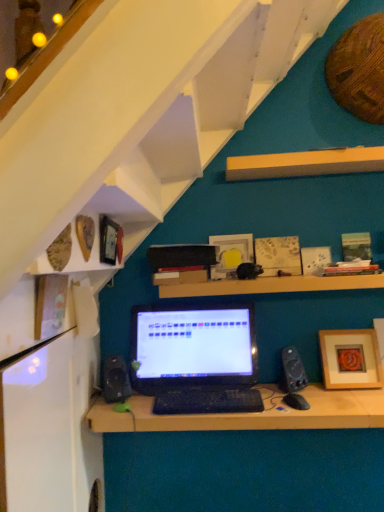
Question: From the image's perspective, would you say yellow wood shelf at upper center, positioned as the 3th shelf in bottom-to-top order, is shown under wooden picture frame at lower right, the third picture frame positioned from the front?

Choices:
 (A) no
 (B) yes

Answer: (A)

Question: Is wooden picture frame at lower right, positioned as the fifth picture frame in left-to-right order, surrounded by yellow wood shelf at upper center, arranged as the 1th shelf when viewed from the top?

Choices:
 (A) no
 (B) yes

Answer: (A)

Question: Can you confirm if yellow wood shelf at upper center, positioned as the 3th shelf in bottom-to-top order, is taller than wooden picture frame at lower right, positioned as the fifth picture frame in left-to-right order?

Choices:
 (A) yes
 (B) no

Answer: (B)

Question: Does yellow wood shelf at upper center, positioned as the 3th shelf in bottom-to-top order, have a lesser height compared to wooden picture frame at lower right, the third picture frame positioned from the front?

Choices:
 (A) no
 (B) yes

Answer: (B)

Question: Is the position of yellow wood shelf at upper center, positioned as the 3th shelf in bottom-to-top order, less distant than that of wooden picture frame at lower right, positioned as the fifth picture frame in left-to-right order?

Choices:
 (A) yes
 (B) no

Answer: (A)

Question: Considering the relative sizes of yellow wood shelf at upper center, positioned as the 3th shelf in bottom-to-top order, and wooden picture frame at lower right, the third picture frame positioned from the front, in the image provided, is yellow wood shelf at upper center, positioned as the 3th shelf in bottom-to-top order, smaller than wooden picture frame at lower right, the third picture frame positioned from the front,?

Choices:
 (A) yes
 (B) no

Answer: (B)

Question: Is wooden textured picture frame at upper center, the 2th picture frame positioned from the back, at the left side of yellow wood shelf at upper center, arranged as the 1th shelf when viewed from the top?

Choices:
 (A) yes
 (B) no

Answer: (A)

Question: Is wooden textured picture frame at upper center, the 2th picture frame positioned from the back, located outside yellow wood shelf at upper center, arranged as the 1th shelf when viewed from the top?

Choices:
 (A) yes
 (B) no

Answer: (A)

Question: Considering the relative sizes of wooden textured picture frame at upper center, the fourth picture frame viewed from the left, and yellow wood shelf at upper center, arranged as the 1th shelf when viewed from the top, in the image provided, is wooden textured picture frame at upper center, the fourth picture frame viewed from the left, taller than yellow wood shelf at upper center, arranged as the 1th shelf when viewed from the top,?

Choices:
 (A) no
 (B) yes

Answer: (B)

Question: Is wooden textured picture frame at upper center, the 2th picture frame positioned from the back, directly adjacent to yellow wood shelf at upper center, positioned as the 3th shelf in bottom-to-top order?

Choices:
 (A) yes
 (B) no

Answer: (B)

Question: Can you confirm if wooden textured picture frame at upper center, arranged as the second picture frame when viewed from the right, is wider than yellow wood shelf at upper center, positioned as the 3th shelf in bottom-to-top order?

Choices:
 (A) no
 (B) yes

Answer: (A)

Question: Can you confirm if wooden textured picture frame at upper center, the 2th picture frame positioned from the back, is positioned to the right of yellow wood shelf at upper center, arranged as the 1th shelf when viewed from the top?

Choices:
 (A) yes
 (B) no

Answer: (B)

Question: From the image's perspective, does black matte laptop at center appear lower than matte white picture frame at center, positioned as the fifth picture frame in front-to-back order?

Choices:
 (A) no
 (B) yes

Answer: (B)